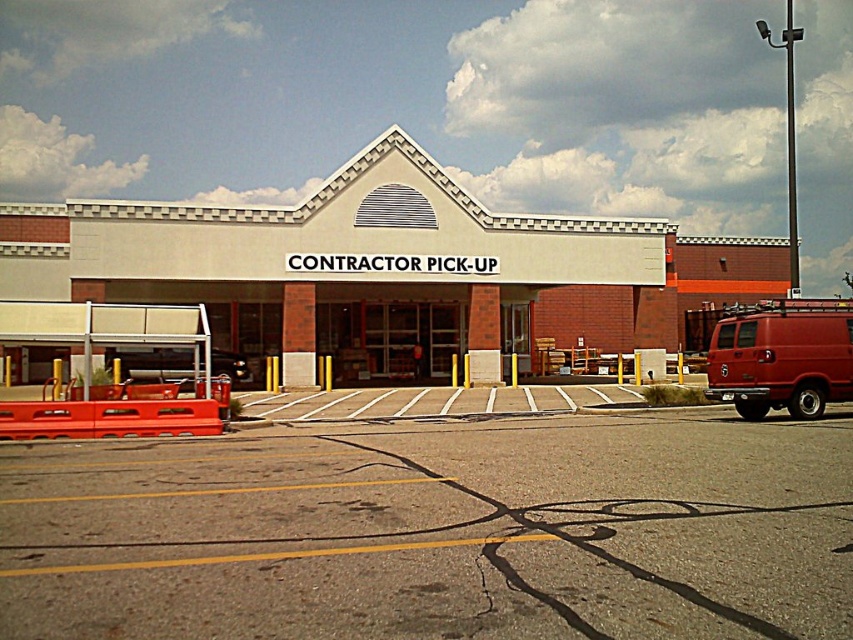
Does point (682, 477) come behind point (126, 353)?

No, it is in front of (126, 353).

Is point (490, 424) less distant than point (167, 371)?

Yes, it is.

Where is `gray asphalt parking lot at center`? Image resolution: width=853 pixels, height=640 pixels. gray asphalt parking lot at center is located at coordinates (437, 524).

Between gray asphalt parking lot at center and white brick mall at center, which one is positioned higher?

white brick mall at center

Is gray asphalt parking lot at center positioned at the back of white brick mall at center?

No, it is in front of white brick mall at center.

Between point (843, 499) and point (440, 292), which one is positioned in front?

Point (843, 499)

Where is `gray asphalt parking lot at center`? gray asphalt parking lot at center is located at coordinates (437, 524).

Is white brick mall at center bigger than matte red van at right?

Yes, white brick mall at center is bigger than matte red van at right.

Is white brick mall at center thinner than matte red van at right?

No.

Is point (33, 241) farther from camera compared to point (724, 330)?

Yes, point (33, 241) is behind point (724, 330).

Where is `white brick mall at center`? The image size is (853, 640). white brick mall at center is located at coordinates (386, 268).